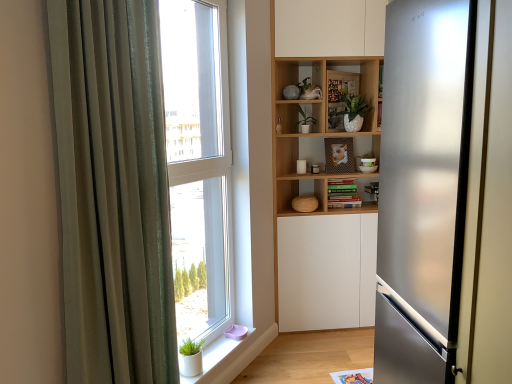
You are a GUI agent. You are given a task and a screenshot of the screen. Output one action in this format:
    pyautogui.click(x=<x>, y=<y>)
    Task: Click on the green matte plant at center, which is the first plant from left to right
    The width and height of the screenshot is (512, 384).
    Given the screenshot: What is the action you would take?
    pyautogui.click(x=305, y=120)

The width and height of the screenshot is (512, 384). Find the location of `white matte window sill at lower left`. white matte window sill at lower left is located at coordinates (218, 355).

The image size is (512, 384). In order to click on green matte plant at upper center, marked as the second plant in a left-to-right arrangement in this screenshot , I will do `click(354, 106)`.

Where is `satin silver refrigerator at right`? satin silver refrigerator at right is located at coordinates (435, 175).

Describe the element at coordinates (435, 175) in the screenshot. This screenshot has height=384, width=512. I see `satin silver refrigerator at right` at that location.

At what (x,y) coordinates should I click in order to perform the action: click on green matte plant at center, which is the first plant from left to right. Please return your answer as a coordinate pair (x, y). The image size is (512, 384). Looking at the image, I should click on (305, 120).

Between transparent glass window at center and green matte plant at center, the second plant in the right-to-left sequence, which one has smaller size?

green matte plant at center, the second plant in the right-to-left sequence.

Is green matte plant at center, the second plant in the right-to-left sequence, at the back of transparent glass window at center?

transparent glass window at center is not turned away from green matte plant at center, the second plant in the right-to-left sequence.

Based on the photo, from a real-world perspective, which is physically above, transparent glass window at center or green matte plant at center, the second plant in the right-to-left sequence?

green matte plant at center, the second plant in the right-to-left sequence, is physically above.

How different are the orientations of transparent glass window at center and green matte plant at center, which is the first plant from left to right, in degrees?

55.4 degrees.

Considering the sizes of green matte plant at center, which is the first plant from left to right, and satin silver refrigerator at right in the image, is green matte plant at center, which is the first plant from left to right, taller or shorter than satin silver refrigerator at right?

In the image, green matte plant at center, which is the first plant from left to right, appears to be shorter than satin silver refrigerator at right.

Is green matte plant at center, which is the first plant from left to right, oriented towards satin silver refrigerator at right?

Yes, green matte plant at center, which is the first plant from left to right, is turned towards satin silver refrigerator at right.

How much distance is there between green matte plant at center, which is the first plant from left to right, and satin silver refrigerator at right?

They are 1.35 meters apart.

Considering the relative sizes of green matte plant at center, which is the first plant from left to right, and satin silver refrigerator at right in the image provided, is green matte plant at center, which is the first plant from left to right, smaller than satin silver refrigerator at right?

Yes, green matte plant at center, which is the first plant from left to right, is smaller than satin silver refrigerator at right.

Can you see white matte window sill at lower left touching green sheer curtain at left?

white matte window sill at lower left and green sheer curtain at left are not in contact.

Who is bigger, white matte window sill at lower left or green sheer curtain at left?

green sheer curtain at left.

The width and height of the screenshot is (512, 384). I want to click on curtain that is above the white matte window sill at lower left (from a real-world perspective), so click(113, 191).

Is white matte window sill at lower left oriented towards green sheer curtain at left?

No, white matte window sill at lower left is not aimed at green sheer curtain at left.

From a real-world perspective, relative to satin silver refrigerator at right, is white matte window sill at lower left vertically above or below?

In terms of real-world spatial position, white matte window sill at lower left is below satin silver refrigerator at right.

Is white matte window sill at lower left bigger than satin silver refrigerator at right?

No, white matte window sill at lower left is not bigger than satin silver refrigerator at right.

Considering the positions of objects white matte window sill at lower left and satin silver refrigerator at right in the image provided, who is in front, white matte window sill at lower left or satin silver refrigerator at right?

satin silver refrigerator at right.

Is white matte window sill at lower left to the left or to the right of satin silver refrigerator at right in the image?

In the image, white matte window sill at lower left appears on the left side of satin silver refrigerator at right.

Considering the positions of points (343, 135) and (217, 363), is point (343, 135) closer to camera compared to point (217, 363)?

No, (343, 135) is behind (217, 363).

Which is more to the right, wooden bookshelf at center or white matte window sill at lower left?

wooden bookshelf at center.

Does wooden bookshelf at center have a lesser height compared to white matte window sill at lower left?

Incorrect, the height of wooden bookshelf at center does not fall short of that of white matte window sill at lower left.

Does satin silver refrigerator at right have a lesser width compared to white matte window sill at lower left?

No, satin silver refrigerator at right is not thinner than white matte window sill at lower left.

Are satin silver refrigerator at right and white matte window sill at lower left making contact?

No, satin silver refrigerator at right is not in contact with white matte window sill at lower left.

Find the location of a particular element. The height and width of the screenshot is (384, 512). window sill located below the satin silver refrigerator at right (from the image's perspective) is located at coordinates (218, 355).

Which object is closer to the camera, wooden bookshelf at center or green sheer curtain at left?

green sheer curtain at left is closer to the camera.

You are a GUI agent. You are given a task and a screenshot of the screen. Output one action in this format:
    pyautogui.click(x=<x>, y=<y>)
    Task: Click on the curtain located on the left of wooden bookshelf at center
    The height and width of the screenshot is (384, 512).
    Given the screenshot: What is the action you would take?
    pyautogui.click(x=113, y=191)

Is point (325, 67) farther from viewer compared to point (137, 237)?

Yes, point (325, 67) is behind point (137, 237).

From the picture: Can you confirm if wooden bookshelf at center is positioned to the right of green sheer curtain at left?

Indeed, wooden bookshelf at center is positioned on the right side of green sheer curtain at left.

You are a GUI agent. You are given a task and a screenshot of the screen. Output one action in this format:
    pyautogui.click(x=<x>, y=<y>)
    Task: Click on the plant that is the 1st one when counting upward from the transparent glass window at center (from the image's perspective)
    
    Given the screenshot: What is the action you would take?
    pyautogui.click(x=305, y=120)

Image resolution: width=512 pixels, height=384 pixels. Find the location of `the 2nd plant behind the satin silver refrigerator at right`. the 2nd plant behind the satin silver refrigerator at right is located at coordinates (305, 120).

Estimate the real-world distances between objects in this image. Which object is further from green matte plant at upper center, the 1th plant from the right, wooden bookshelf at center or satin silver refrigerator at right?

Based on the image, satin silver refrigerator at right appears to be further to green matte plant at upper center, the 1th plant from the right.

Looking at the image, which one is located further to transparent glass window at center, satin silver refrigerator at right or green sheer curtain at left?

satin silver refrigerator at right is positioned further to the anchor transparent glass window at center.

Considering their positions, is green sheer curtain at left positioned closer to white matte window sill at lower left than wooden bookshelf at center?

The object closer to white matte window sill at lower left is green sheer curtain at left.

From the image, which object appears to be nearer to wooden bookshelf at center, green matte plant at center, the second plant in the right-to-left sequence, or green sheer curtain at left?

green matte plant at center, the second plant in the right-to-left sequence, lies closer to wooden bookshelf at center than the other object.

Which object lies nearer to the anchor point wooden bookshelf at center, green sheer curtain at left or satin silver refrigerator at right?

satin silver refrigerator at right is closer to wooden bookshelf at center.

Looking at the image, which one is located closer to transparent glass window at center, white matte window sill at lower left or green sheer curtain at left?

white matte window sill at lower left lies closer to transparent glass window at center than the other object.

Based on their spatial positions, is transparent glass window at center or green sheer curtain at left further from white matte window sill at lower left?

The object further to white matte window sill at lower left is green sheer curtain at left.

When comparing their distances from wooden bookshelf at center, does green sheer curtain at left or white matte window sill at lower left seem closer?

white matte window sill at lower left.

Locate an element on the screen. window between wooden bookshelf at center and white matte window sill at lower left in the up-down direction is located at coordinates (200, 168).

Find the location of `plant between transparent glass window at center and green matte plant at center, the second plant in the right-to-left sequence, along the z-axis`. plant between transparent glass window at center and green matte plant at center, the second plant in the right-to-left sequence, along the z-axis is located at coordinates tap(354, 106).

At what (x,y) coordinates should I click in order to perform the action: click on plant between green matte plant at upper center, the 1th plant from the right, and white matte window sill at lower left, in the vertical direction. Please return your answer as a coordinate pair (x, y). Looking at the image, I should click on (305, 120).

Locate an element on the screen. plant between satin silver refrigerator at right and green matte plant at center, the second plant in the right-to-left sequence, along the z-axis is located at coordinates (354, 106).